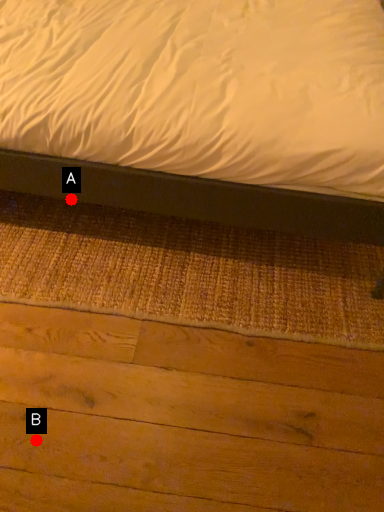
Question: Two points are circled on the image, labeled by A and B beside each circle. Which point is closer to the camera taking this photo?

Choices:
 (A) A is closer
 (B) B is closer

Answer: (B)